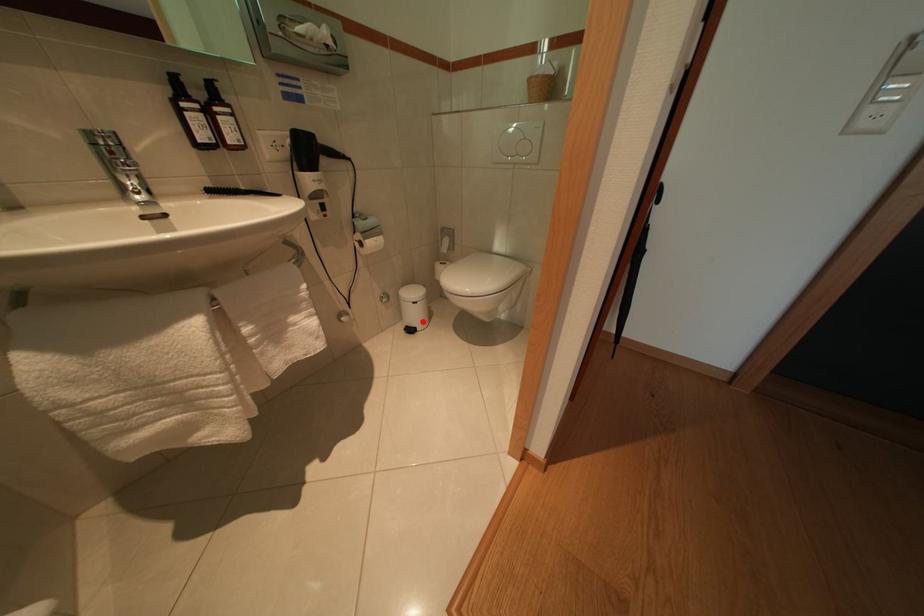
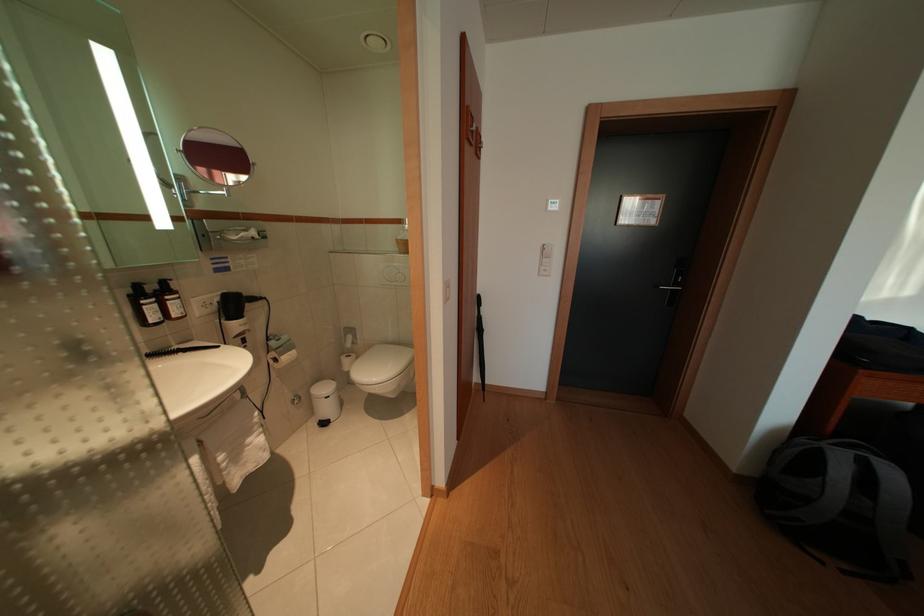
Question: I am providing you with two images of the same scene from different viewpoints. Given a red point in image1, look at the same physical point in image2. Is it:

Choices:
 (A) Closer to the viewpoint
 (B) Farther from the viewpoint

Answer: (B)